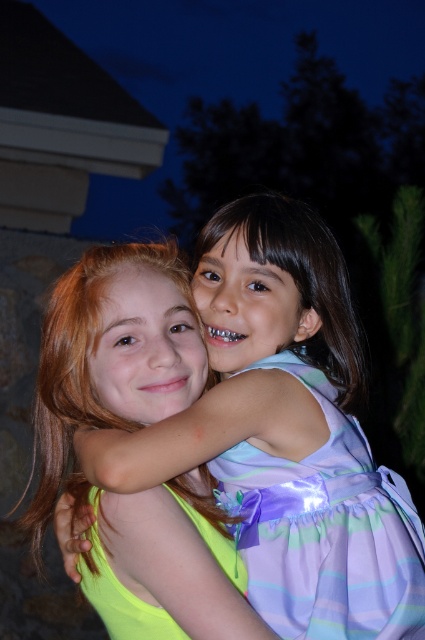
Question: Is purple satin dress at center in front of neon green satin dress at center?

Choices:
 (A) yes
 (B) no

Answer: (B)

Question: Which point is farther from the camera taking this photo?

Choices:
 (A) 257,196
 (B) 302,624
 (C) 223,554

Answer: (A)

Question: Can you confirm if purple satin dress at center is positioned to the left of neon green satin dress at center?

Choices:
 (A) yes
 (B) no

Answer: (B)

Question: Which point is closer to the camera taking this photo?

Choices:
 (A) (240, 508)
 (B) (244, 317)
 (C) (136, 611)

Answer: (C)

Question: Is neon green dress at center thinner than purple satin dress at center?

Choices:
 (A) yes
 (B) no

Answer: (B)

Question: Which object is positioned closest to the neon green dress at center?

Choices:
 (A) purple satin dress at center
 (B) neon green satin dress at center

Answer: (A)